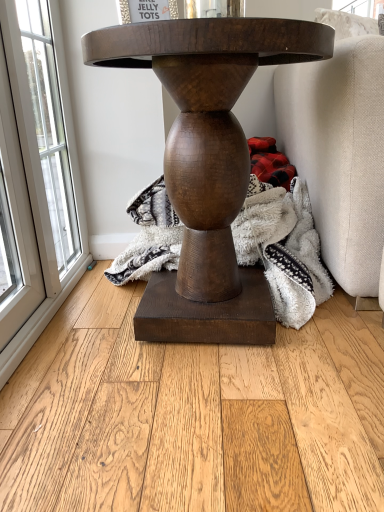
The image size is (384, 512). Describe the element at coordinates (39, 170) in the screenshot. I see `clear glass window at left` at that location.

This screenshot has height=512, width=384. I want to click on red plaid fabric at lower right, so click(x=270, y=162).

Identify the location of matte brown wooden table at center. (207, 164).

Measure the distance between point [326,298] and camera.

The depth of point [326,298] is 3.91 feet.

Locate an element on the screen. The image size is (384, 512). natural wood flooring at center is located at coordinates (193, 415).

In the scene shown: How different are the orientations of red plaid fabric at lower right and clear glass window at left in degrees?

The angle between the facing direction of red plaid fabric at lower right and the facing direction of clear glass window at left is 89.9 degrees.

You are a GUI agent. You are given a task and a screenshot of the screen. Output one action in this format:
    pyautogui.click(x=<x>, y=<y>)
    Task: Click on the material that is on the right side of clear glass window at left
    This screenshot has height=512, width=384.
    Given the screenshot: What is the action you would take?
    pyautogui.click(x=270, y=162)

Considering the relative sizes of red plaid fabric at lower right and clear glass window at left in the image provided, is red plaid fabric at lower right wider than clear glass window at left?

Correct, the width of red plaid fabric at lower right exceeds that of clear glass window at left.

Which of these two, red plaid fabric at lower right or clear glass window at left, is smaller?

red plaid fabric at lower right.

Where is `window behind the fuzzy white blanket at center`? This screenshot has width=384, height=512. window behind the fuzzy white blanket at center is located at coordinates (39, 170).

Is point (33, 212) positioned in front of point (251, 194)?

Yes, point (33, 212) is closer to viewer.

From the image's perspective, does clear glass window at left appear higher than fuzzy white blanket at center?

Indeed, from the image's perspective, clear glass window at left is shown above fuzzy white blanket at center.

Can you confirm if clear glass window at left is thinner than fuzzy white blanket at center?

Yes, clear glass window at left is thinner than fuzzy white blanket at center.

Which object is positioned more to the left, clear glass window at left or red plaid fabric at lower right?

clear glass window at left is more to the left.

In the scene shown: Is clear glass window at left positioned with its back to red plaid fabric at lower right?

No.

Who is smaller, clear glass window at left or red plaid fabric at lower right?

red plaid fabric at lower right.

From the image's perspective, between natural wood flooring at center and red plaid fabric at lower right, who is located below?

natural wood flooring at center appears lower in the image.

Does natural wood flooring at center turn towards red plaid fabric at lower right?

No, natural wood flooring at center does not turn towards red plaid fabric at lower right.

From the picture: From a real-world perspective, is natural wood flooring at center positioned under red plaid fabric at lower right based on gravity?

Correct, in the physical world, natural wood flooring at center is lower than red plaid fabric at lower right.

Which of these two, natural wood flooring at center or red plaid fabric at lower right, stands taller?

red plaid fabric at lower right.

Can you confirm if fuzzy white blanket at center is smaller than matte brown wooden table at center?

Yes, fuzzy white blanket at center is smaller than matte brown wooden table at center.

From the image's perspective, is fuzzy white blanket at center located above or below matte brown wooden table at center?

fuzzy white blanket at center is below matte brown wooden table at center.

Can you confirm if fuzzy white blanket at center is shorter than matte brown wooden table at center?

Yes.

In terms of width, does fuzzy white blanket at center look wider or thinner when compared to matte brown wooden table at center?

fuzzy white blanket at center is thinner than matte brown wooden table at center.

Would you consider matte brown wooden table at center to be distant from red plaid fabric at lower right?

They are positioned close to each other.

From a real-world perspective, is matte brown wooden table at center below red plaid fabric at lower right?

Incorrect, from a real-world perspective, matte brown wooden table at center is higher than red plaid fabric at lower right.

Is point (135, 30) in front of point (265, 149)?

Yes, point (135, 30) is closer to viewer.

Between matte brown wooden table at center and red plaid fabric at lower right, which one has less height?

Answer: Standing shorter between the two is red plaid fabric at lower right.

Considering the positions of objects red plaid fabric at lower right and natural wood flooring at center in the image provided, who is in front, red plaid fabric at lower right or natural wood flooring at center?

Positioned in front is natural wood flooring at center.

Which object is wider, red plaid fabric at lower right or natural wood flooring at center?

Wider between the two is natural wood flooring at center.

In terms of height, does red plaid fabric at lower right look taller or shorter compared to natural wood flooring at center?

Considering their sizes, red plaid fabric at lower right has more height than natural wood flooring at center.

Locate an element on the screen. window positioned vertically above the red plaid fabric at lower right (from a real-world perspective) is located at coordinates (39, 170).

I want to click on window on the left of fuzzy white blanket at center, so click(x=39, y=170).

From the image, which object appears to be farther from red plaid fabric at lower right, natural wood flooring at center or clear glass window at left?

The object further to red plaid fabric at lower right is natural wood flooring at center.

When comparing their distances from red plaid fabric at lower right, does fuzzy white blanket at center or clear glass window at left seem closer?

fuzzy white blanket at center.

Looking at this image, estimate the real-world distances between objects in this image. Which object is further from red plaid fabric at lower right, natural wood flooring at center or matte brown wooden table at center?

natural wood flooring at center lies further to red plaid fabric at lower right than the other object.

In the scene shown: Considering their positions, is red plaid fabric at lower right positioned further to clear glass window at left than fuzzy white blanket at center?

red plaid fabric at lower right.

Which object lies further to the anchor point red plaid fabric at lower right, clear glass window at left or natural wood flooring at center?

Based on the image, natural wood flooring at center appears to be further to red plaid fabric at lower right.

From the image, which object appears to be farther from fuzzy white blanket at center, clear glass window at left or natural wood flooring at center?

Among the two, clear glass window at left is located further to fuzzy white blanket at center.

Estimate the real-world distances between objects in this image. Which object is closer to matte brown wooden table at center, clear glass window at left or fuzzy white blanket at center?

fuzzy white blanket at center.

From the image, which object appears to be nearer to clear glass window at left, red plaid fabric at lower right or natural wood flooring at center?

natural wood flooring at center lies closer to clear glass window at left than the other object.

Where is `table between natural wood flooring at center and red plaid fabric at lower right from front to back`? This screenshot has width=384, height=512. table between natural wood flooring at center and red plaid fabric at lower right from front to back is located at coordinates (207, 164).

Locate an element on the screen. The height and width of the screenshot is (512, 384). blanket between clear glass window at left and red plaid fabric at lower right is located at coordinates (283, 248).

In order to click on blanket between clear glass window at left and matte brown wooden table at center in this screenshot , I will do `click(283, 248)`.

Identify the location of blanket between matte brown wooden table at center and natural wood flooring at center in the vertical direction. (283, 248).